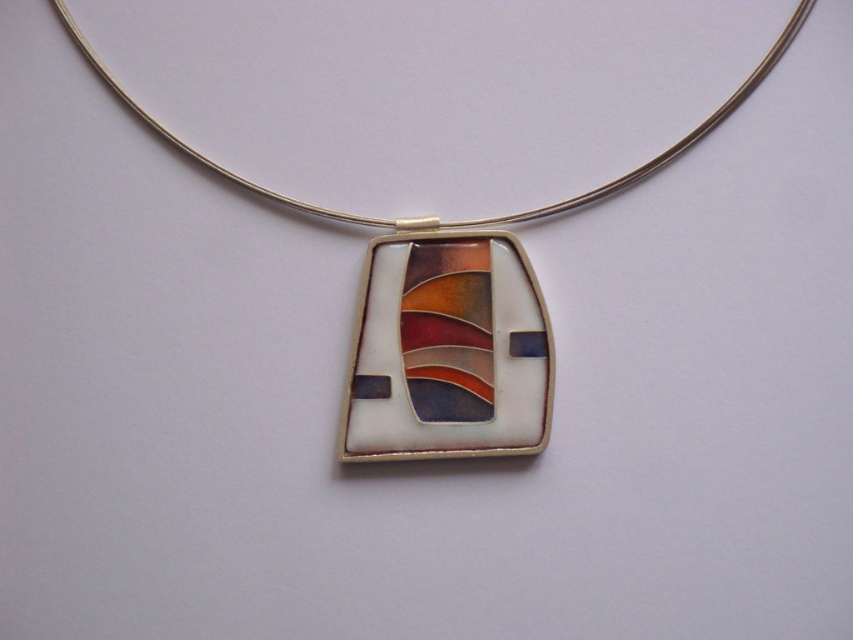
You are an appraiser examining a pendant. The pendant is displayed on a white background. The pendant has a rectangular shape with rounded edges and a central section with a wavy pattern in orange, red, and brown, surrounded by smaller sections in white, black, and deep blue, all framed by a gold border. The pendant is attached to a silver chain. According to the coordinates provided, where is the matte silver pendant at center located?

The matte silver pendant at center is located at point [450,312].